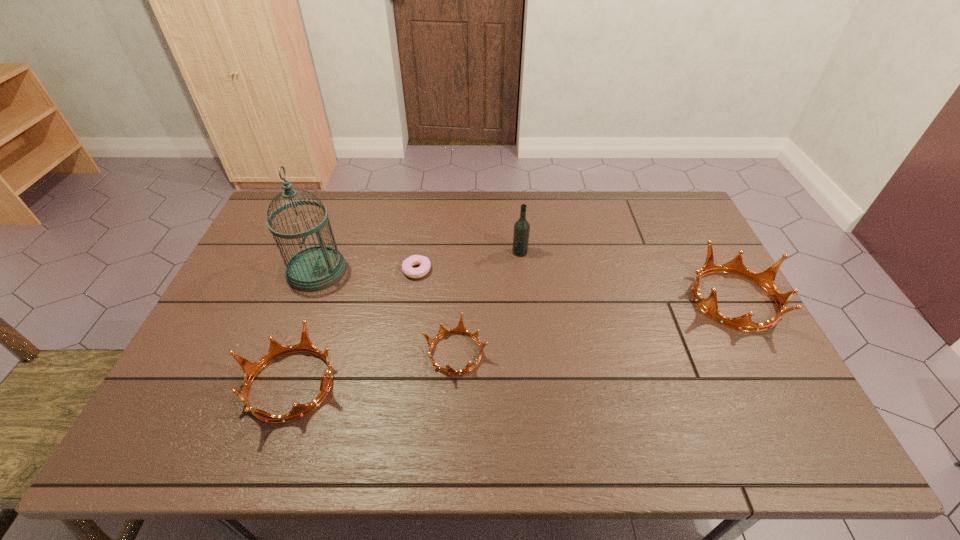
The width and height of the screenshot is (960, 540). What are the coordinates of `the second tallest crown` in the screenshot? It's located at (276, 350).

Identify the location of the fourth tallest object. This screenshot has height=540, width=960. (276, 350).

This screenshot has width=960, height=540. What are the coordinates of `the second crown from left to right` in the screenshot? It's located at (460, 329).

What are the coordinates of `the shortest crown` in the screenshot? It's located at (460, 329).

Find the location of a particular element. Image resolution: width=960 pixels, height=540 pixels. the rightmost object is located at coordinates (766, 279).

Find the location of a particular element. birdcage is located at coordinates [x=316, y=267].

Identify the location of the shortest object. The image size is (960, 540). (424, 262).

Locate an element on the screen. the third object from left to right is located at coordinates (424, 262).

Locate an element on the screen. The height and width of the screenshot is (540, 960). the fifth shortest object is located at coordinates (521, 227).

This screenshot has height=540, width=960. What are the coordinates of `vodka` in the screenshot? It's located at (521, 227).